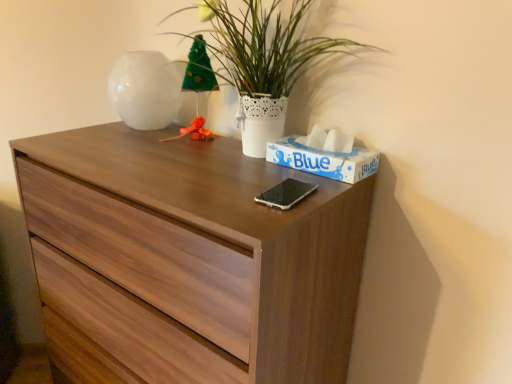
Find the location of a particular element. This screenshot has height=384, width=512. vacant area in front of green leafy plant at upper center is located at coordinates (223, 182).